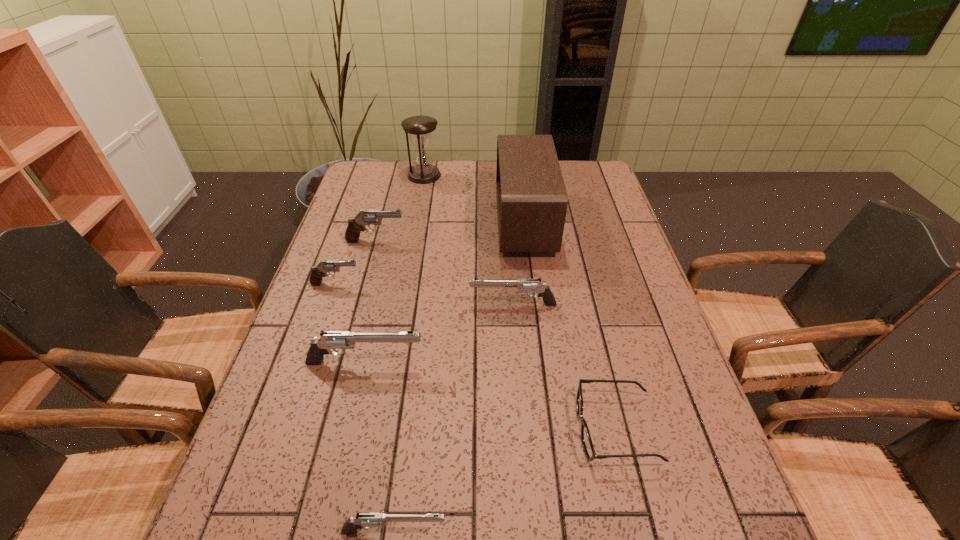
Locate an element on the screen. the nearest silver pistol is located at coordinates (368, 519).

Locate an element on the screen. The height and width of the screenshot is (540, 960). the nearest object is located at coordinates (368, 519).

This screenshot has width=960, height=540. I want to click on the shortest object, so click(x=590, y=453).

I want to click on spectacles, so click(x=590, y=453).

In order to click on vacant space positioned 0.150m on the front-facing side of the brown radio receiver in this screenshot , I will do `click(450, 221)`.

Find the location of a particular element. vacant area situated 0.160m on the front-facing side of the brown radio receiver is located at coordinates (447, 221).

The width and height of the screenshot is (960, 540). What are the coordinates of `free location located 0.290m on the front-facing side of the brown radio receiver` in the screenshot? It's located at (407, 221).

This screenshot has height=540, width=960. Find the location of `vacant space located 0.180m on the front of the farthest object`. vacant space located 0.180m on the front of the farthest object is located at coordinates (418, 213).

Locate an element on the screen. Image resolution: width=960 pixels, height=540 pixels. vacant position located 0.190m at the barrel of the farther gray pistol is located at coordinates (468, 241).

Locate an element on the screen. The height and width of the screenshot is (540, 960). vacant area situated 0.080m on the front-facing side of the third nearest object is located at coordinates (460, 363).